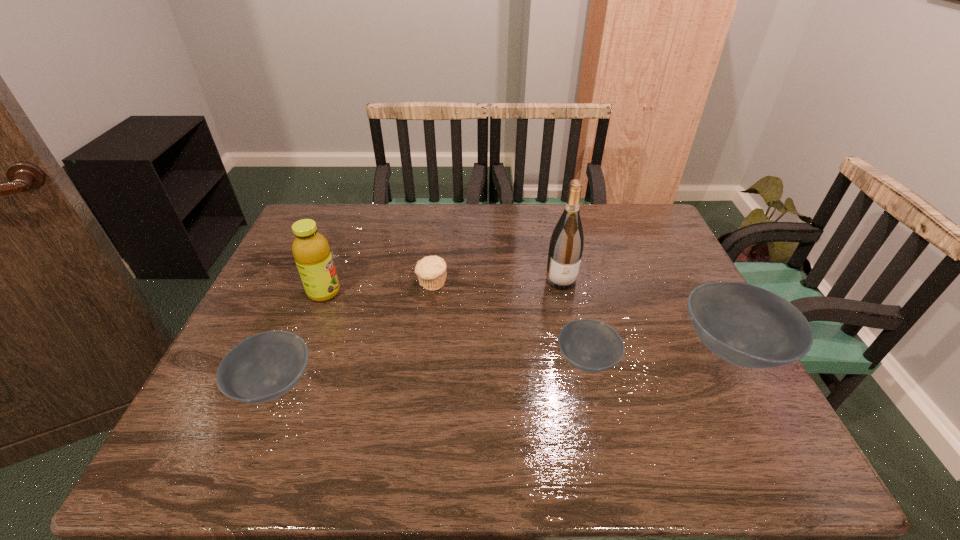
Where is `free region at the near edge`? This screenshot has width=960, height=540. free region at the near edge is located at coordinates (616, 416).

This screenshot has width=960, height=540. Find the location of `free space at the left edge of the desktop`. free space at the left edge of the desktop is located at coordinates (292, 253).

The image size is (960, 540). I want to click on vacant space at the right edge, so click(x=653, y=268).

In the image, there is a desktop. At what (x,y) coordinates should I click in order to perform the action: click on vacant space at the far left corner. Please return your answer as a coordinate pair (x, y). The image size is (960, 540). Looking at the image, I should click on (330, 237).

The image size is (960, 540). In order to click on free space between the shortest object and the tallest bowl in this screenshot , I will do `click(660, 355)`.

This screenshot has width=960, height=540. In order to click on unoccupied area between the tallest object and the leftmost bowl in this screenshot , I will do `click(418, 333)`.

Locate an element on the screen. empty location between the muffin and the shortest bowl is located at coordinates (510, 322).

The height and width of the screenshot is (540, 960). What are the coordinates of `vacant space that's between the wine bottle and the leftmost bowl` in the screenshot? It's located at (418, 333).

You are a GUI agent. You are given a task and a screenshot of the screen. Output one action in this format:
    pyautogui.click(x=<x>, y=<y>)
    Task: Click on the free space between the muffin and the second tallest bowl
    The image size is (960, 540).
    Given the screenshot: What is the action you would take?
    pyautogui.click(x=353, y=334)

Locate an element on the screen. free space that is in between the wine bottle and the rightmost bowl is located at coordinates (646, 315).